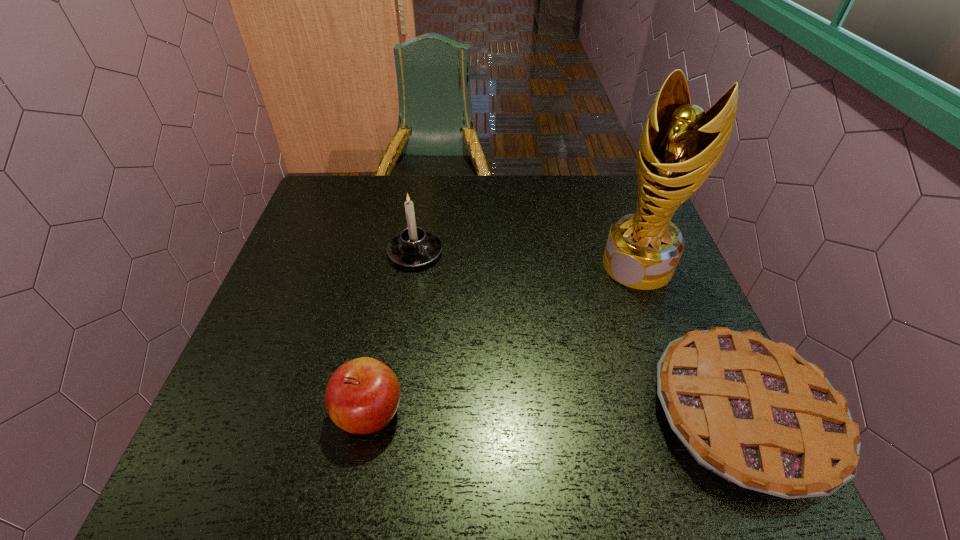
Where is `apple`? Image resolution: width=960 pixels, height=540 pixels. apple is located at coordinates (362, 396).

The image size is (960, 540). I want to click on pie, so click(x=754, y=412).

Locate an element on the screen. award is located at coordinates (680, 144).

Where is `the third shortest object`? This screenshot has width=960, height=540. the third shortest object is located at coordinates (414, 247).

This screenshot has height=540, width=960. I want to click on free space located 0.400m on the back of the second shortest object, so click(x=399, y=253).

The height and width of the screenshot is (540, 960). In order to click on vacant region located 0.380m on the left of the shortest object in this screenshot , I will do [x=458, y=414].

In order to click on free space located on the front-facing side of the award in this screenshot , I will do `click(552, 363)`.

Find the location of a particular element. The image size is (960, 540). vacant point located 0.260m on the front-facing side of the award is located at coordinates 564,348.

Find the location of a particular element. Image resolution: width=960 pixels, height=540 pixels. free location located on the front-facing side of the award is located at coordinates (579, 332).

At what (x,y) coordinates should I click in order to perform the action: click on vacant area located 0.350m with a handle on the side of the candle holder. Please return your answer as a coordinate pair (x, y). This screenshot has width=960, height=540. Looking at the image, I should click on (526, 350).